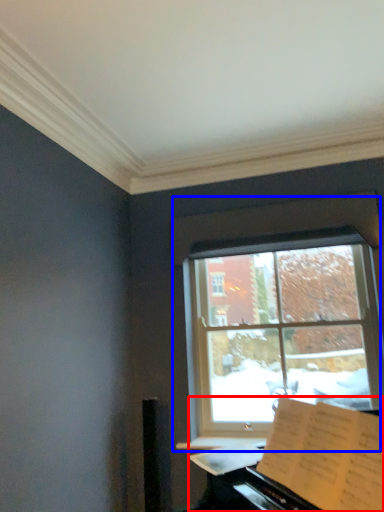
Question: Which object is further to the camera taking this photo, piano (highlighted by a red box) or window (highlighted by a blue box)?

Choices:
 (A) piano
 (B) window

Answer: (B)